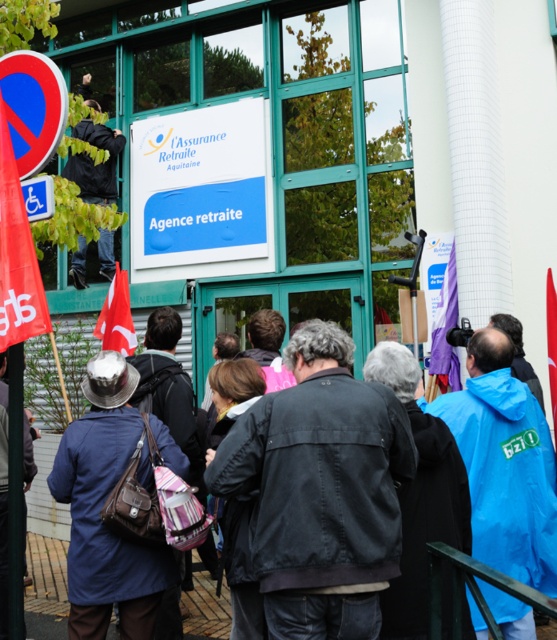
Question: Estimate the real-world distances between objects in this image. Which object is closer to the red plastic sign at upper left?

Choices:
 (A) purple fabric flag at center
 (B) blue fabric coat at center
 (C) red fabric flag at lower left

Answer: (B)

Question: Is black leather jacket at upper left to the left of purple fabric flag at center from the viewer's perspective?

Choices:
 (A) yes
 (B) no

Answer: (A)

Question: Among these points, which one is farthest from the camera?

Choices:
 (A) (460, 380)
 (B) (12, 204)

Answer: (A)

Question: Which object is positioned closest to the red fabric flag at left?

Choices:
 (A) purple fabric flag at center
 (B) red plastic sign at upper left

Answer: (B)

Question: Where is white plastic sign at upper center located in relation to red fabric flag at lower left in the image?

Choices:
 (A) left
 (B) right

Answer: (B)

Question: Does blue waterproof jacket at center appear on the right side of red fabric flag at lower left?

Choices:
 (A) yes
 (B) no

Answer: (A)